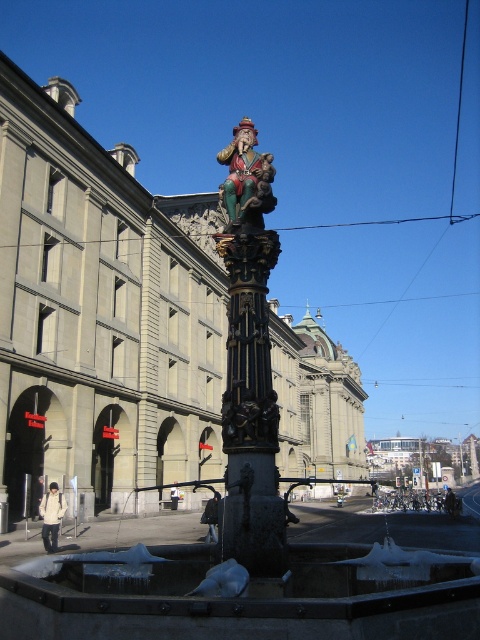
You are an art student trying to sketch the fountain. You notice the polished bronze column at center and the polychrome wood figure at center. Which object should you focus on first if you want to draw the taller one?

The polychrome wood figure at center is taller than the polished bronze column at center, so you should focus on drawing the polychrome wood figure at center first.

You are standing at point (251, 412) in the city square. What object is located exactly at your current position?

The polished bronze column at center is located exactly at point (251, 412).

You are standing in the city square and want to take a photo of the fountain. You notice two points marked on the ground at coordinates point (264,273) and point (249,192). Which point should you stand at to ensure the statue on top of the fountain is fully visible without any obstruction from the column?

You should stand at point (264,273) because it is in front of point (249,192), providing a clearer view of the statue on top of the fountain without obstruction from the column.